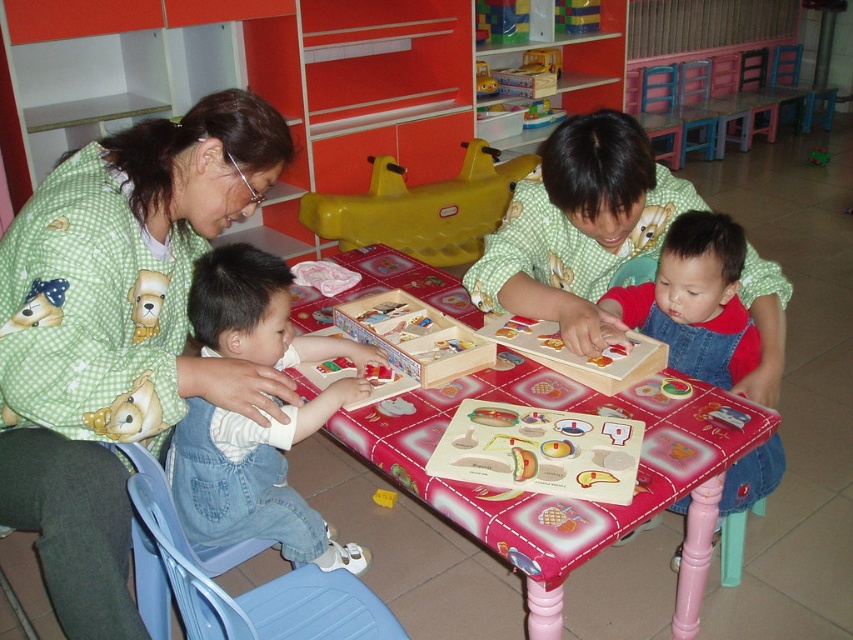
Question: Does wooden puzzle board at center lie in front of denim overalls at lower right?

Choices:
 (A) yes
 (B) no

Answer: (A)

Question: Which of the following is the closest to the observer?

Choices:
 (A) green checkered shirt at center
 (B) green checkered shirt at upper left
 (C) yellow plastic swing at center
 (D) denim overalls at lower left

Answer: (B)

Question: Is denim overalls at lower right above yellow plastic swing at center?

Choices:
 (A) no
 (B) yes

Answer: (A)

Question: Can you confirm if green checkered shirt at upper left is positioned above green checkered shirt at center?

Choices:
 (A) yes
 (B) no

Answer: (A)

Question: Among these objects, which one is farthest from the camera?

Choices:
 (A) yellow plastic swing at center
 (B) green checkered shirt at center

Answer: (A)

Question: Which object appears farthest from the camera in this image?

Choices:
 (A) green matte toy at center
 (B) denim overalls at lower right
 (C) wooden puzzle board at center
 (D) soft plush dog at left

Answer: (A)